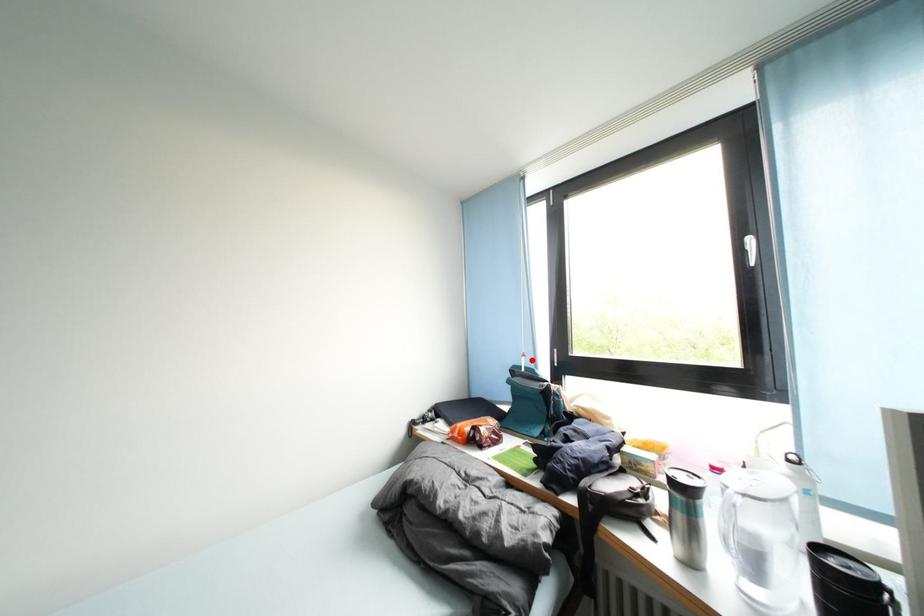
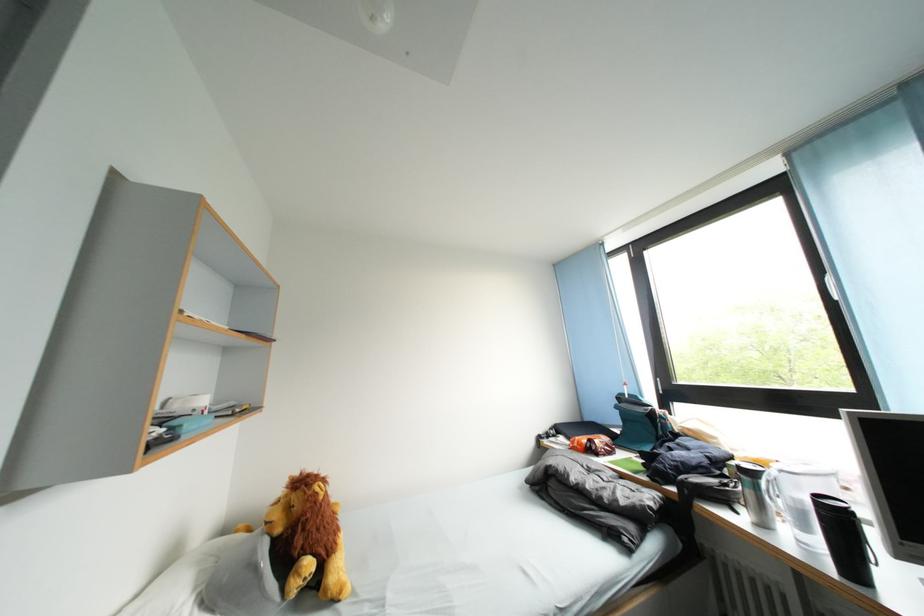
Locate, in the second image, the point that corresponds to the highlighted location in the first image.

(634, 389)